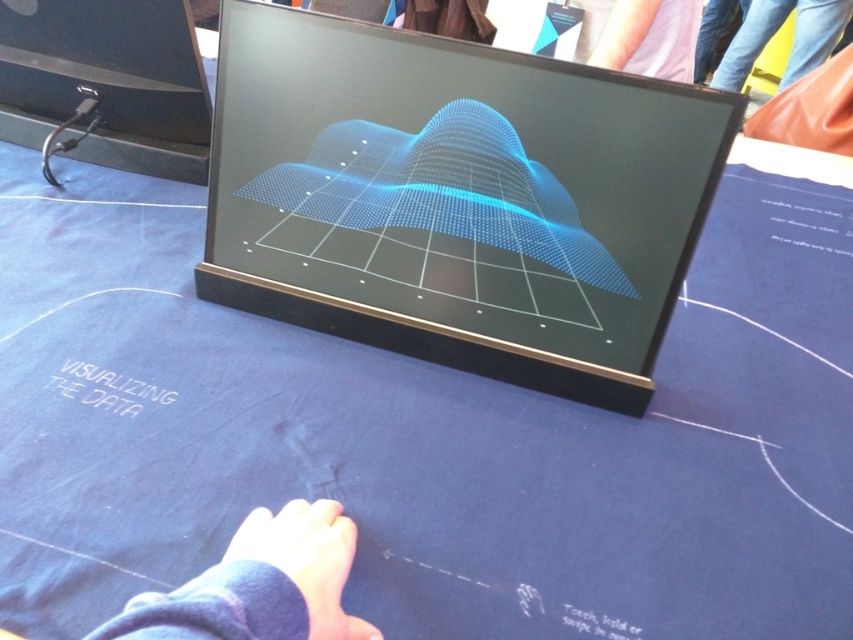
Question: Among these points, which one is farthest from the camera?

Choices:
 (A) (445, 124)
 (B) (346, 577)

Answer: (A)

Question: Does matte black laptop at center lie in front of skinny blue fabric at lower center?

Choices:
 (A) no
 (B) yes

Answer: (A)

Question: Can you confirm if matte black laptop at center is positioned to the right of skinny blue fabric at lower center?

Choices:
 (A) no
 (B) yes

Answer: (B)

Question: Is matte black laptop at center smaller than skinny blue fabric at lower center?

Choices:
 (A) no
 (B) yes

Answer: (A)

Question: Which point is closer to the camera taking this photo?

Choices:
 (A) (291, 580)
 (B) (746, 76)
 (C) (223, 44)

Answer: (A)

Question: Considering the real-world distances, which object is closest to the skinny blue fabric at lower center?

Choices:
 (A) matte black laptop at center
 (B) jeans at upper right

Answer: (A)